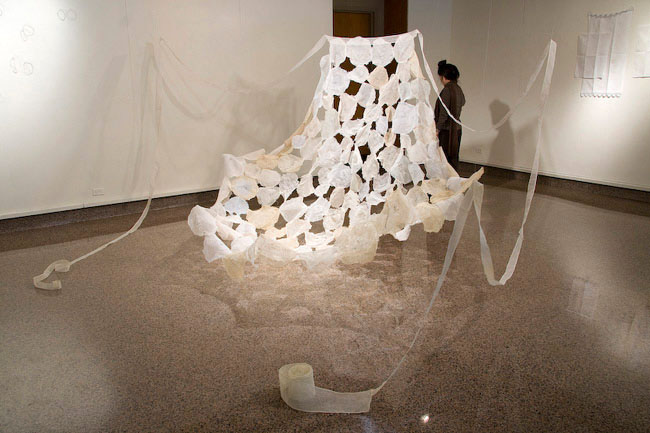
The image size is (650, 433). In order to click on door in this screenshot , I will do `click(364, 19)`.